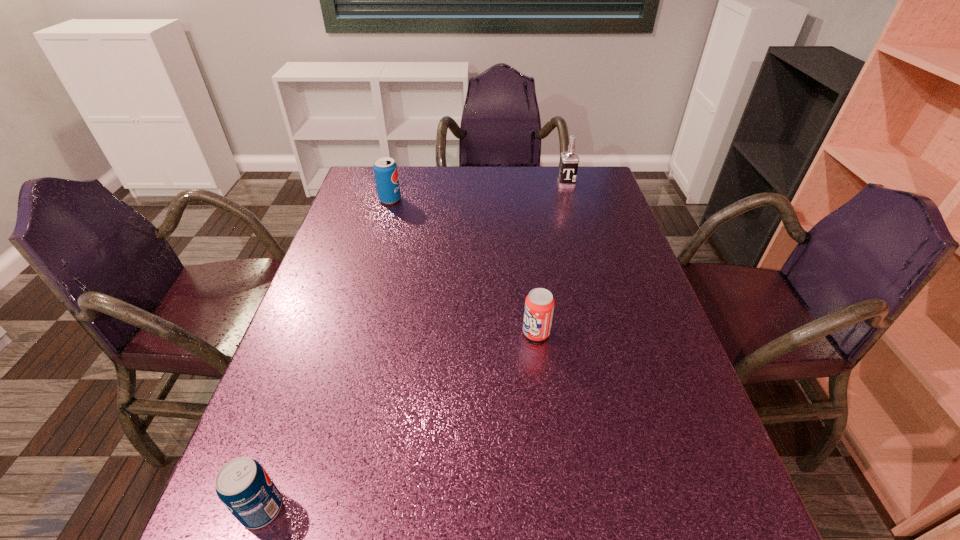
Identify the location of vacant space located on the surface of the second nearest object. The width and height of the screenshot is (960, 540). (410, 333).

Locate an element on the screen. vacant space located on the surface of the second nearest object is located at coordinates (484, 333).

At what (x,y) coordinates should I click in order to perform the action: click on vodka located at the far edge. Please return your answer as a coordinate pair (x, y). Looking at the image, I should click on (569, 161).

Locate an element on the screen. The image size is (960, 540). soda can at the far edge is located at coordinates (385, 169).

Locate an element on the screen. object positioned at the right edge is located at coordinates (569, 161).

You are a GUI agent. You are given a task and a screenshot of the screen. Output one action in this format:
    pyautogui.click(x=<x>, y=<y>)
    Task: Click on the object present at the far left corner
    
    Given the screenshot: What is the action you would take?
    pyautogui.click(x=385, y=169)

Where is `object present at the far right corner`? The height and width of the screenshot is (540, 960). object present at the far right corner is located at coordinates (569, 161).

In the image, there is a desktop. Where is `vacant space at the far edge`? The height and width of the screenshot is (540, 960). vacant space at the far edge is located at coordinates (504, 195).

The height and width of the screenshot is (540, 960). What are the coordinates of `blank space at the left edge` in the screenshot? It's located at (352, 210).

Identify the location of vacant area at the right edge. (640, 379).